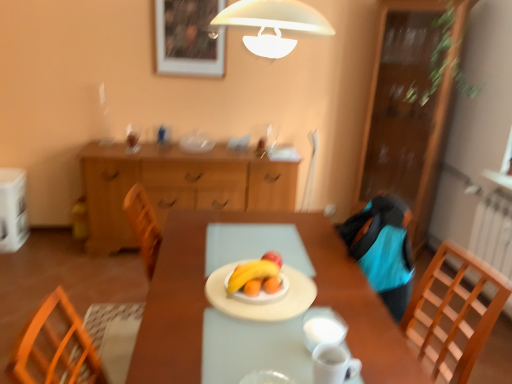
Locate an element on the screen. The width and height of the screenshot is (512, 384). free space to the back side of white glossy mug at lower center, the 3th tableware viewed from the back is located at coordinates (293, 338).